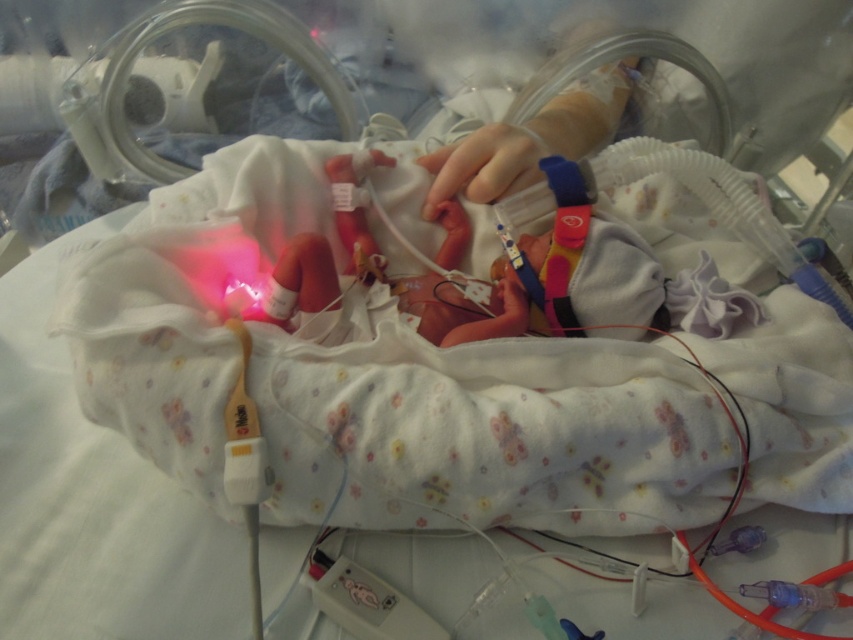
Question: Which of the following is the farthest from the observer?

Choices:
 (A) (605, 292)
 (B) (451, 157)

Answer: (B)

Question: Is smooth skin newborn at center thinner than smooth skin hand at center?

Choices:
 (A) yes
 (B) no

Answer: (B)

Question: Where is smooth skin newborn at center located in relation to smooth skin hand at center in the image?

Choices:
 (A) left
 (B) right

Answer: (A)

Question: Can you confirm if smooth skin newborn at center is wider than smooth skin hand at center?

Choices:
 (A) yes
 (B) no

Answer: (A)